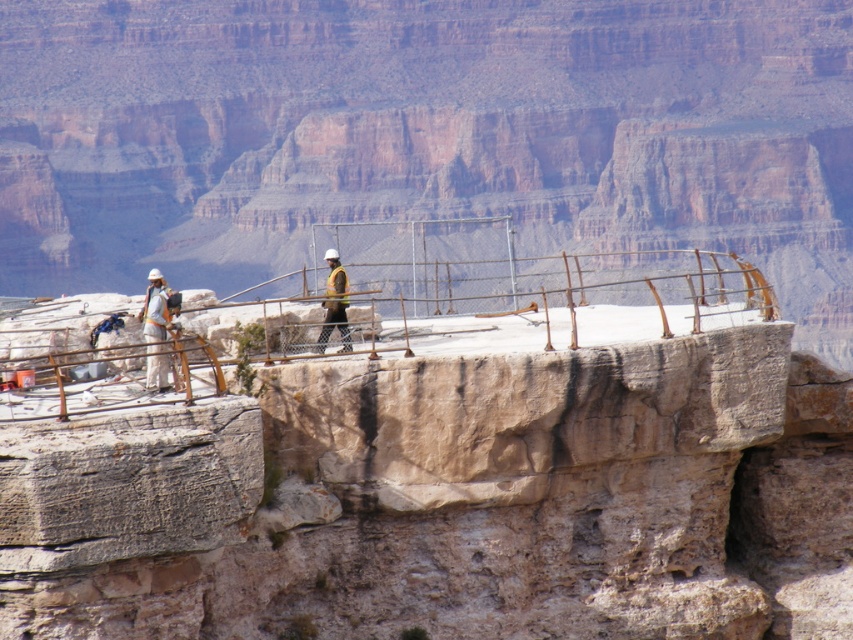
Does white hard hat at left have a larger size compared to hard hat construction worker at center?

Correct, white hard hat at left is larger in size than hard hat construction worker at center.

Which of these two, white hard hat at left or hard hat construction worker at center, stands shorter?

Standing shorter between the two is hard hat construction worker at center.

Identify the location of white hard hat at left. The height and width of the screenshot is (640, 853). (157, 326).

The image size is (853, 640). Identify the location of white hard hat at left. (157, 326).

This screenshot has width=853, height=640. In order to click on brown rock canyon at center in this screenshot , I will do `click(422, 132)`.

Between point (283, 548) and point (335, 275), which one is positioned in front?

Point (283, 548) is in front.

Is smooth concrete platform at center further to camera compared to hard hat construction worker at center?

No, smooth concrete platform at center is in front of hard hat construction worker at center.

This screenshot has width=853, height=640. Find the location of `smooth concrete platform at center`. smooth concrete platform at center is located at coordinates (448, 483).